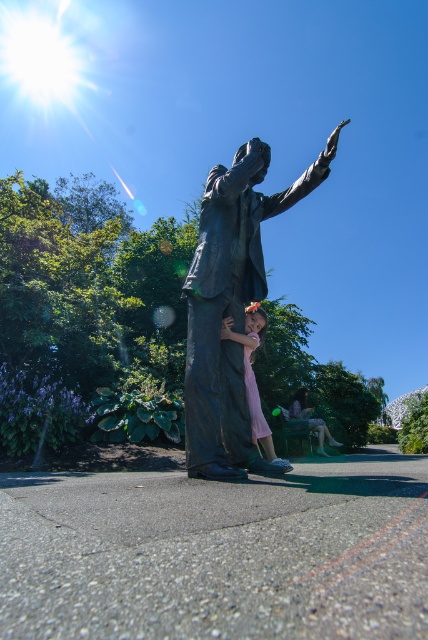
You are standing in the park and see the bronze statue at center. There is a point marked at coordinates [231,305]. Where is this point located?

The point marked at coordinates [231,305] is on the bronze statue at center.

You are a photographer adjusting your camera settings. You notice two points in the scene at coordinates point (226, 244) and point (253, 310). Which point should you focus on to ensure the statue of the person in formal attire is in sharp focus?

You should focus on point (226, 244) because it is closer to the camera than point (253, 310), ensuring the statue of the person in formal attire is in sharp focus.

You are a photographer setting up a shot of the bronze statue at center and the matte green dress at lower right. To ensure both are in focus, you need to know their relative sizes. Which object is bigger?

The bronze statue at center is larger in size compared to the matte green dress at lower right, so you should adjust your camera settings to accommodate the size difference for proper focus.